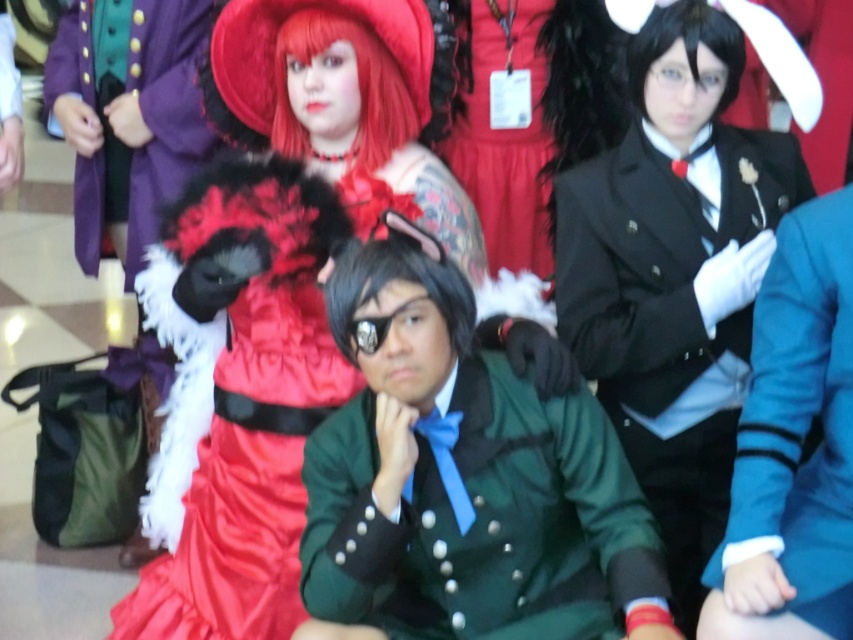
You are a photographer at a fashion show and need to capture both the black satin blazer at upper right and the teal wool blazer at right in a single frame. Based on their positions, which blazer will appear closer to the camera?

The black satin blazer at upper right will appear closer to the camera because the teal wool blazer at right is positioned behind it.

You are a photographer at a cosplay event and want to ensure that the red dress and green uniform are both visible in your photo. Since the satin red dress at upper center is taller than the green satin uniform at center, which object should you focus on to ensure both are in frame?

Since the satin red dress at upper center is taller than the green satin uniform at center, you should focus on the taller object, the satin red dress at upper center, to ensure both are visible in the frame.

You are organizing a photo shoot and need to arrange two models wearing the green satin uniform at center and teal wool blazer at right. Based on their clothing, which model should stand closer to the camera to ensure both appear equally wide in the photo?

The green satin uniform at center is wider than the teal wool blazer at right, so the model in the green satin uniform at center should stand farther from the camera to balance their apparent widths.